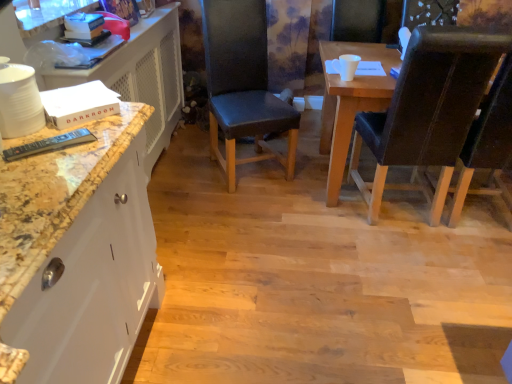
This screenshot has height=384, width=512. In order to click on vacant space in front of dark brown leather chair at right, arranged as the 3th chair when viewed from the left in this screenshot , I will do `click(471, 269)`.